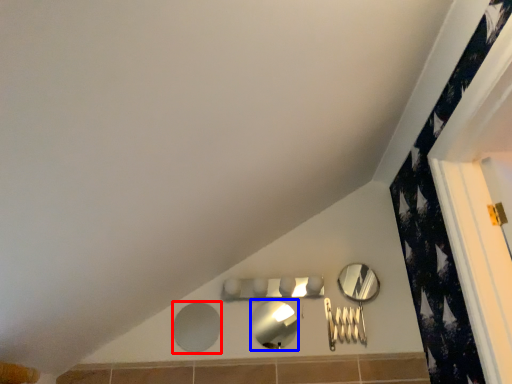
Question: Which object is further to the camera taking this photo, mirror (highlighted by a red box) or mirror (highlighted by a blue box)?

Choices:
 (A) mirror
 (B) mirror

Answer: (A)